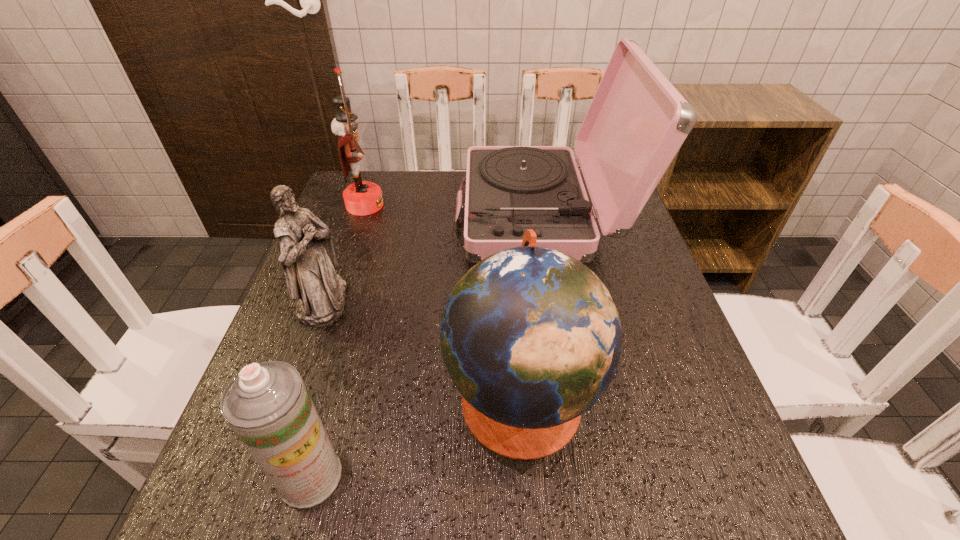
Identify the location of object present at the right edge. The height and width of the screenshot is (540, 960). (637, 121).

Identify the location of object at the far left corner. (361, 198).

This screenshot has height=540, width=960. Find the location of `object that is at the near left corner`. object that is at the near left corner is located at coordinates (267, 405).

The image size is (960, 540). What are the coordinates of `object that is at the far right corner` in the screenshot? It's located at (637, 121).

Find the location of a particular element. The height and width of the screenshot is (540, 960). vacant space at the near edge of the desktop is located at coordinates (564, 508).

The image size is (960, 540). Identify the location of free location at the left edge. (338, 248).

This screenshot has width=960, height=540. Identify the location of vacant space at the right edge. (669, 386).

Locate an element on the screen. This screenshot has height=540, width=960. blank space at the far left corner of the desktop is located at coordinates (337, 197).

This screenshot has width=960, height=540. Identify the location of free region at the near left corner. (190, 532).

Image resolution: width=960 pixels, height=540 pixels. I want to click on vacant space at the near right corner of the desktop, so click(662, 492).